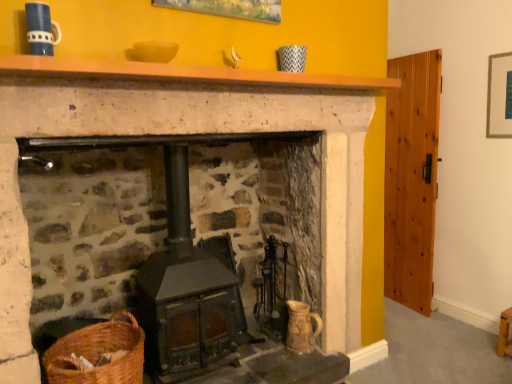
Question: Would you say wooden mantle at upper center is to the left or to the right of woven brown basket at lower left in the picture?

Choices:
 (A) left
 (B) right

Answer: (B)

Question: Is wooden mantle at upper center taller or shorter than woven brown basket at lower left?

Choices:
 (A) tall
 (B) short

Answer: (B)

Question: Based on their relative distances, which object is farther from the wooden stool at lower right?

Choices:
 (A) metallic silver picture frame at upper right
 (B) rustic wood stove at center
 (C) woven brown basket at lower left
 (D) wooden mantle at upper center

Answer: (C)

Question: Which object is the closest to the wooden mantle at upper center?

Choices:
 (A) rustic wood stove at center
 (B) metallic silver picture frame at upper right
 (C) woven brown basket at lower left
 (D) wooden stool at lower right

Answer: (A)